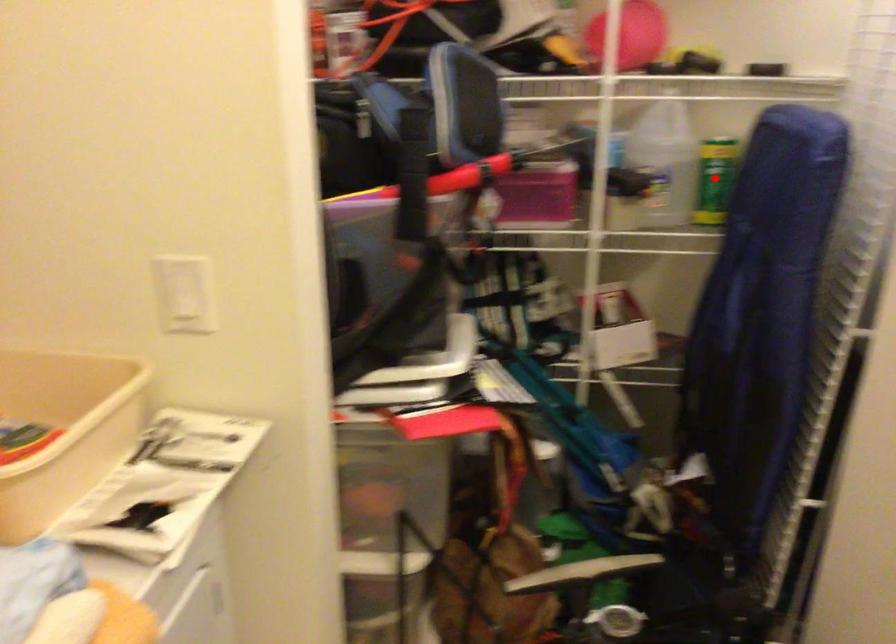
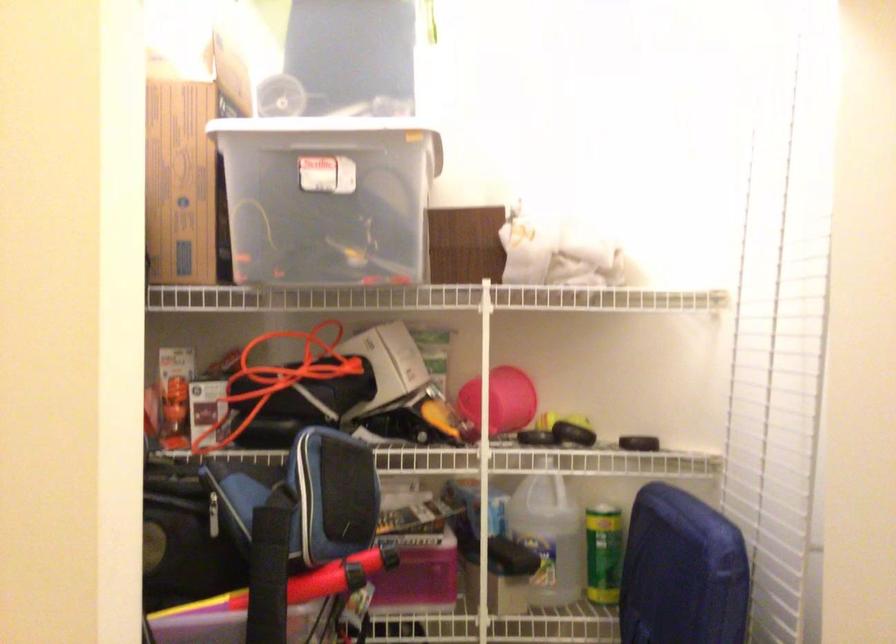
Question: I am providing you with two images of the same scene from different viewpoints. A red point is marked on the first image. At the location where the point appears in image 1, is it still visible in image 2?

Choices:
 (A) Yes
 (B) No

Answer: (A)